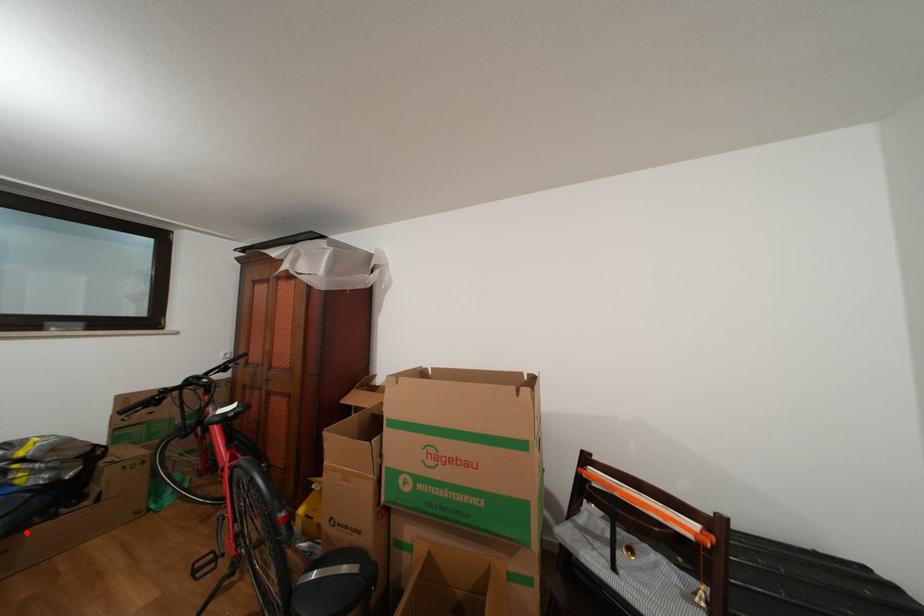
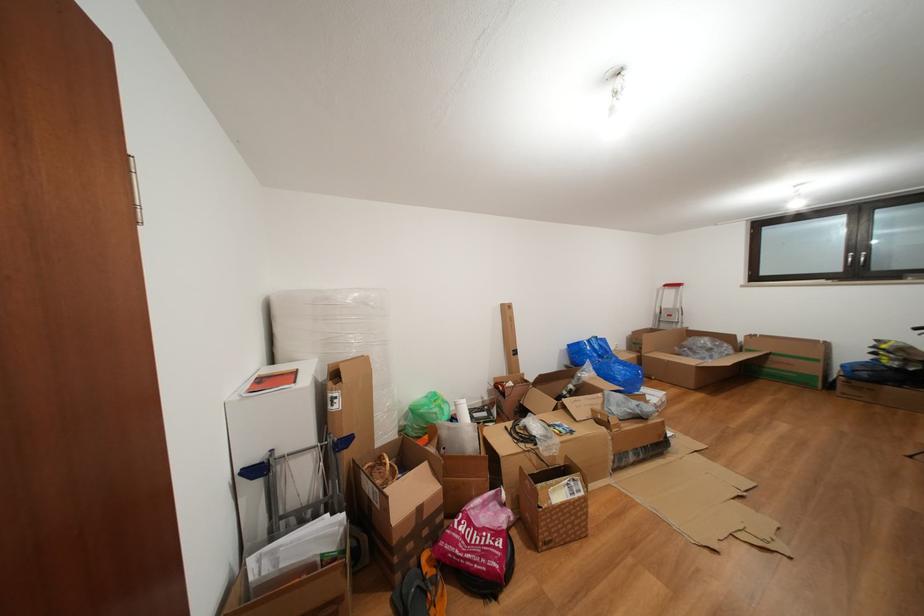
The point at the highlighted location is marked in the first image. Where is the corresponding point in the second image?

(886, 387)